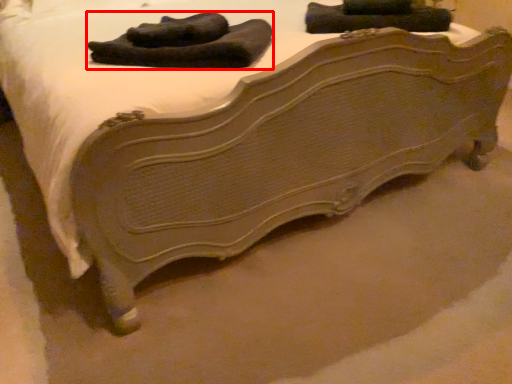
Question: From the image's perspective, what is the correct spatial relationship of laundry (annotated by the red box) in relation to clothing?

Choices:
 (A) below
 (B) above

Answer: (A)